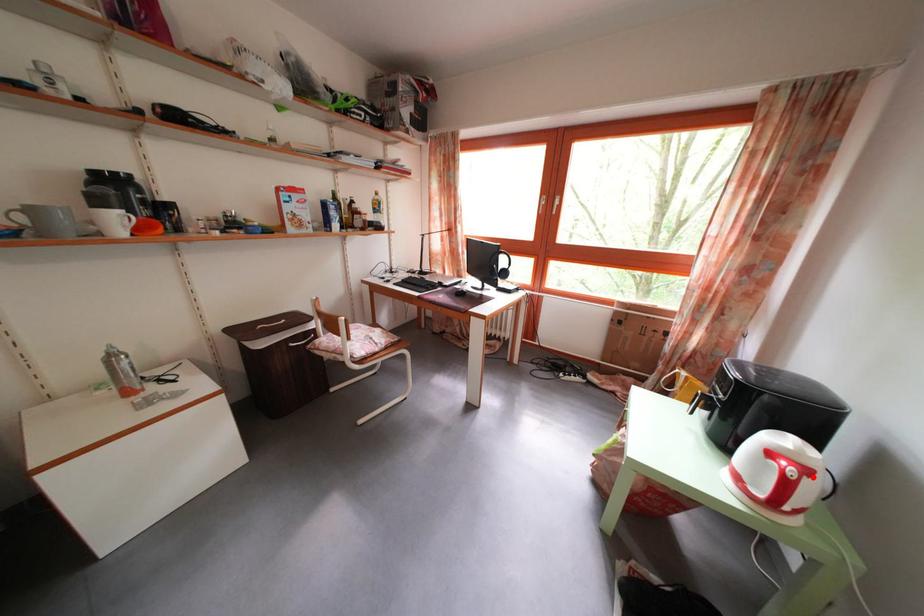
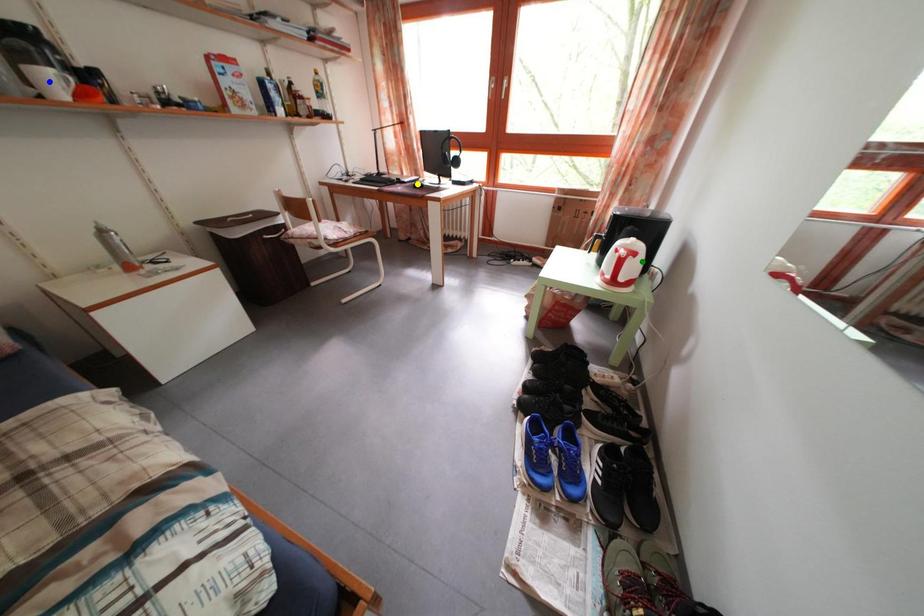
Question: I am providing you with two images of the same scene from different viewpoints. A red point is marked on the first image. You are given multiple points on the second image. Which point in image 2 represents the same 3d spot as the red point in image 1?

Choices:
 (A) green point
 (B) blue point
 (C) yellow point

Answer: (A)